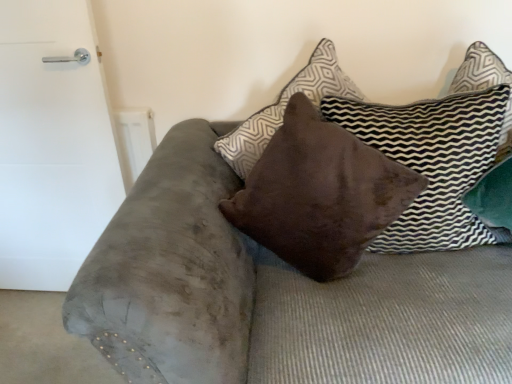
Question: Is brown velvet pillow at center, the 1th pillow in the right-to-left sequence, oriented towards white matte door at left?

Choices:
 (A) yes
 (B) no

Answer: (B)

Question: From a real-world perspective, does brown velvet pillow at center, the 1th pillow in the right-to-left sequence, sit lower than white matte door at left?

Choices:
 (A) no
 (B) yes

Answer: (A)

Question: Is brown velvet pillow at center, the 1th pillow in the right-to-left sequence, wider than white matte door at left?

Choices:
 (A) yes
 (B) no

Answer: (A)

Question: Considering the relative sizes of brown velvet pillow at center, which is the 2th pillow from left to right, and white matte door at left in the image provided, is brown velvet pillow at center, which is the 2th pillow from left to right, thinner than white matte door at left?

Choices:
 (A) yes
 (B) no

Answer: (B)

Question: Does brown velvet pillow at center, which is the 2th pillow from left to right, have a greater height compared to white matte door at left?

Choices:
 (A) yes
 (B) no

Answer: (B)

Question: Relative to brown velvet pillow at center, the 1th pillow in the right-to-left sequence, is brown suede pillow at center, positioned as the second pillow in right-to-left order, in front or behind?

Choices:
 (A) behind
 (B) front

Answer: (A)

Question: Based on their sizes in the image, would you say brown suede pillow at center, positioned as the second pillow in right-to-left order, is bigger or smaller than brown velvet pillow at center, the 1th pillow in the right-to-left sequence?

Choices:
 (A) big
 (B) small

Answer: (A)

Question: Considering the positions of brown suede pillow at center, positioned as the 1th pillow in left-to-right order, and brown velvet pillow at center, the 1th pillow in the right-to-left sequence, in the image, is brown suede pillow at center, positioned as the 1th pillow in left-to-right order, taller or shorter than brown velvet pillow at center, the 1th pillow in the right-to-left sequence,?

Choices:
 (A) tall
 (B) short

Answer: (A)

Question: Do you think brown suede pillow at center, positioned as the second pillow in right-to-left order, is within brown velvet pillow at center, the 1th pillow in the right-to-left sequence, or outside of it?

Choices:
 (A) inside
 (B) outside

Answer: (B)

Question: From a real-world perspective, is brown suede pillow at center, positioned as the 1th pillow in left-to-right order, positioned above or below white matte door at left?

Choices:
 (A) above
 (B) below

Answer: (A)

Question: From the image's perspective, is brown suede pillow at center, positioned as the 1th pillow in left-to-right order, positioned above or below white matte door at left?

Choices:
 (A) above
 (B) below

Answer: (A)

Question: Looking at their shapes, would you say brown suede pillow at center, positioned as the 1th pillow in left-to-right order, is wider or thinner than white matte door at left?

Choices:
 (A) wide
 (B) thin

Answer: (A)

Question: From their relative heights in the image, would you say brown suede pillow at center, positioned as the second pillow in right-to-left order, is taller or shorter than white matte door at left?

Choices:
 (A) short
 (B) tall

Answer: (A)

Question: Relative to brown suede pillow at center, positioned as the 1th pillow in left-to-right order, is brown velvet pillow at center, which is the 2th pillow from left to right, in front or behind?

Choices:
 (A) behind
 (B) front

Answer: (B)

Question: Is brown velvet pillow at center, which is the 2th pillow from left to right, bigger or smaller than brown suede pillow at center, positioned as the 1th pillow in left-to-right order?

Choices:
 (A) small
 (B) big

Answer: (A)